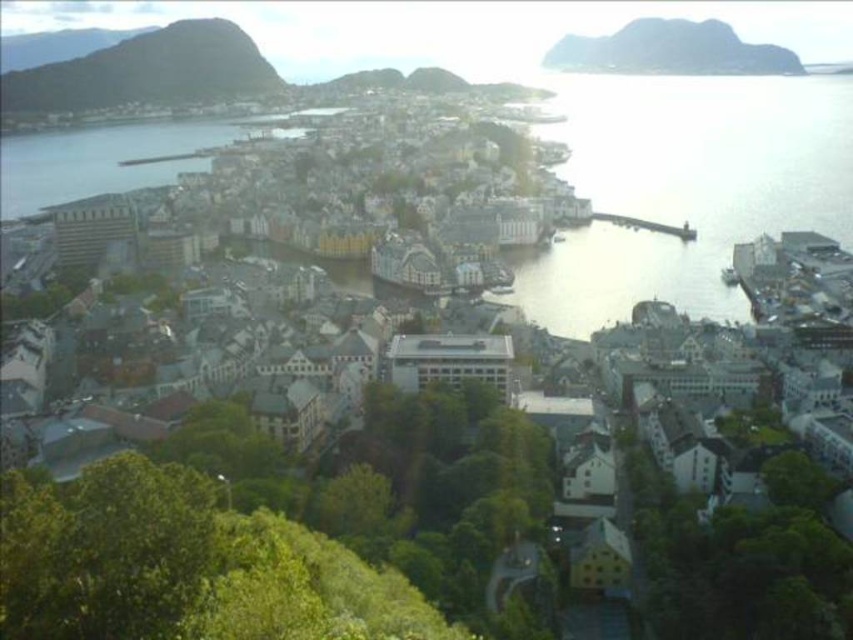
Question: Which object is positioned closest to the rugged brown rock at upper left?

Choices:
 (A) clear water at lower right
 (B) rocky gray cliff at upper right

Answer: (B)

Question: Estimate the real-world distances between objects in this image. Which object is closer to the clear water at lower right?

Choices:
 (A) rugged brown rock at upper left
 (B) rocky gray cliff at upper right

Answer: (B)

Question: Is clear water at lower right to the right of rugged brown rock at upper left from the viewer's perspective?

Choices:
 (A) yes
 (B) no

Answer: (A)

Question: Is clear water at lower right closer to the viewer compared to rocky gray cliff at upper right?

Choices:
 (A) no
 (B) yes

Answer: (B)

Question: Estimate the real-world distances between objects in this image. Which object is farther from the rugged brown rock at upper left?

Choices:
 (A) rocky gray cliff at upper right
 (B) clear water at lower right

Answer: (B)

Question: Where is rugged brown rock at upper left located in relation to rocky gray cliff at upper right in the image?

Choices:
 (A) above
 (B) below

Answer: (B)